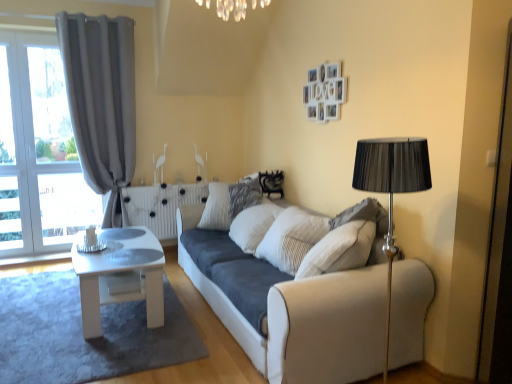
Question: Considering the relative sizes of white fabric couch at center and white glossy coffee table at lower left in the image provided, is white fabric couch at center shorter than white glossy coffee table at lower left?

Choices:
 (A) no
 (B) yes

Answer: (A)

Question: From the image's perspective, would you say white fabric couch at center is shown under white glossy coffee table at lower left?

Choices:
 (A) no
 (B) yes

Answer: (A)

Question: Is white fabric couch at center smaller than white glossy coffee table at lower left?

Choices:
 (A) yes
 (B) no

Answer: (B)

Question: Is white fabric couch at center oriented towards white glossy coffee table at lower left?

Choices:
 (A) no
 (B) yes

Answer: (B)

Question: From the image's perspective, would you say white fabric couch at center is positioned over white glossy coffee table at lower left?

Choices:
 (A) yes
 (B) no

Answer: (A)

Question: Considering their positions, is suede-like beige pillow at right located in front of or behind white fabric couch at center?

Choices:
 (A) behind
 (B) front

Answer: (A)

Question: Is suede-like beige pillow at right spatially inside white fabric couch at center, or outside of it?

Choices:
 (A) outside
 (B) inside

Answer: (A)

Question: Does point (331, 228) appear closer or farther from the camera than point (297, 322)?

Choices:
 (A) farther
 (B) closer

Answer: (A)

Question: Is suede-like beige pillow at right to the left or to the right of white fabric couch at center in the image?

Choices:
 (A) left
 (B) right

Answer: (B)

Question: From a real-world perspective, is white glossy table at center positioned above or below white glossy coffee table at lower left?

Choices:
 (A) above
 (B) below

Answer: (A)

Question: Considering the positions of white glossy table at center and white glossy coffee table at lower left in the image, is white glossy table at center bigger or smaller than white glossy coffee table at lower left?

Choices:
 (A) big
 (B) small

Answer: (A)

Question: Relative to white glossy coffee table at lower left, is white glossy table at center in front or behind?

Choices:
 (A) front
 (B) behind

Answer: (B)

Question: Considering the positions of point (134, 294) and point (1, 322), is point (134, 294) closer or farther from the camera than point (1, 322)?

Choices:
 (A) farther
 (B) closer

Answer: (A)

Question: Is white glossy coffee table at lower left situated inside suede-like beige pillow at right or outside?

Choices:
 (A) outside
 (B) inside

Answer: (A)

Question: Is white glossy coffee table at lower left in front of or behind suede-like beige pillow at right in the image?

Choices:
 (A) front
 (B) behind

Answer: (A)